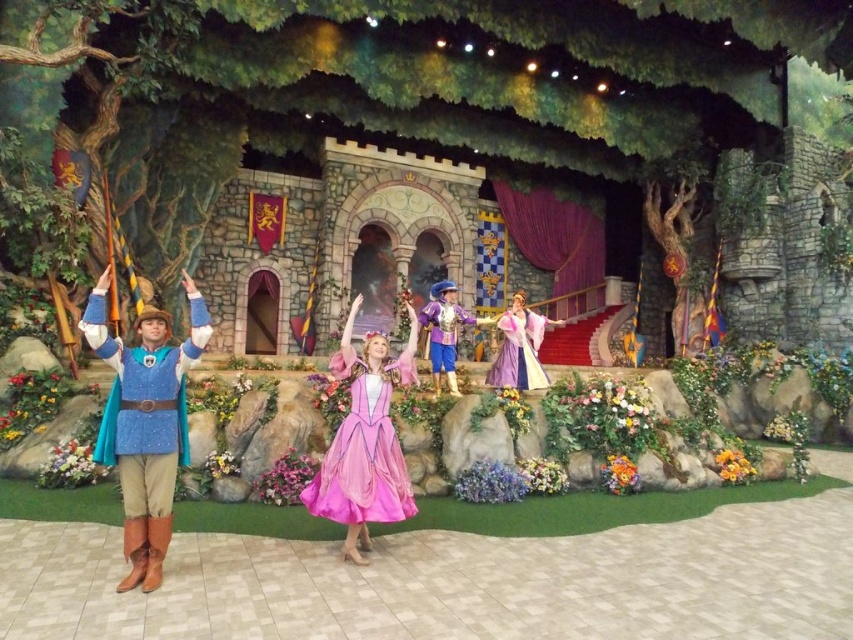
Question: Can you confirm if pastel purple satin dress at center is smaller than shiny gold dress at center?

Choices:
 (A) yes
 (B) no

Answer: (B)

Question: Which object appears closest to the camera in this image?

Choices:
 (A) blue fabric cape at left
 (B) shiny gold dress at center

Answer: (A)

Question: Which object is closer to the camera taking this photo?

Choices:
 (A) pastel purple satin dress at center
 (B) pink satin dress at center

Answer: (B)

Question: Is blue fabric cape at left to the left of shiny gold dress at center from the viewer's perspective?

Choices:
 (A) no
 (B) yes

Answer: (B)

Question: Does pink satin dress at center have a lesser width compared to shiny gold dress at center?

Choices:
 (A) no
 (B) yes

Answer: (B)

Question: Among these objects, which one is farthest from the camera?

Choices:
 (A) blue fabric cape at left
 (B) pink satin dress at center
 (C) pastel purple satin dress at center
 (D) shiny gold dress at center

Answer: (D)